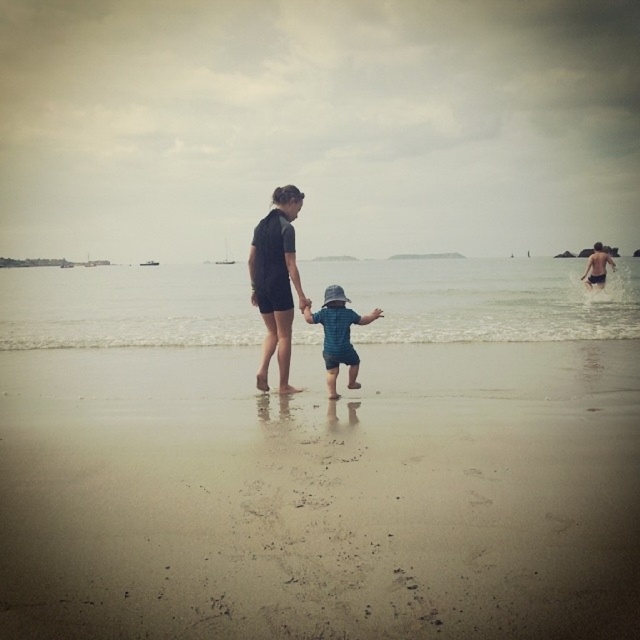
You are a photographer standing on the beach. You want to take a photo of the clear water at center and the blue denim shorts at center. Which object should you focus on first if you want both to be in sharp focus?

The blue denim shorts at center are closer to you than the clear water at center, so you should focus on the blue denim shorts at center first to ensure both are in sharp focus.

You are a drone operator trying to locate a specific point on the beach. The scene shows an adult and a child walking on the wet sand near the shoreline. There is a point marked at coordinates point (321, 496). Where would you direct the drone to find this point?

The point (321, 496) is located on the brown sandy beach at center, so the drone should be directed to the central area of the beach where the sand is brown and not near the wet shoreline where the adult and child are walking.